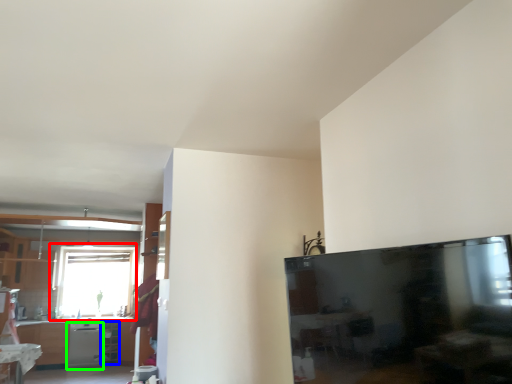
Question: Considering the real-world distances, which object is closest to window (highlighted by a red box)? shelf (highlighted by a blue box) or dish washer (highlighted by a green box).

Choices:
 (A) shelf
 (B) dish washer

Answer: (B)